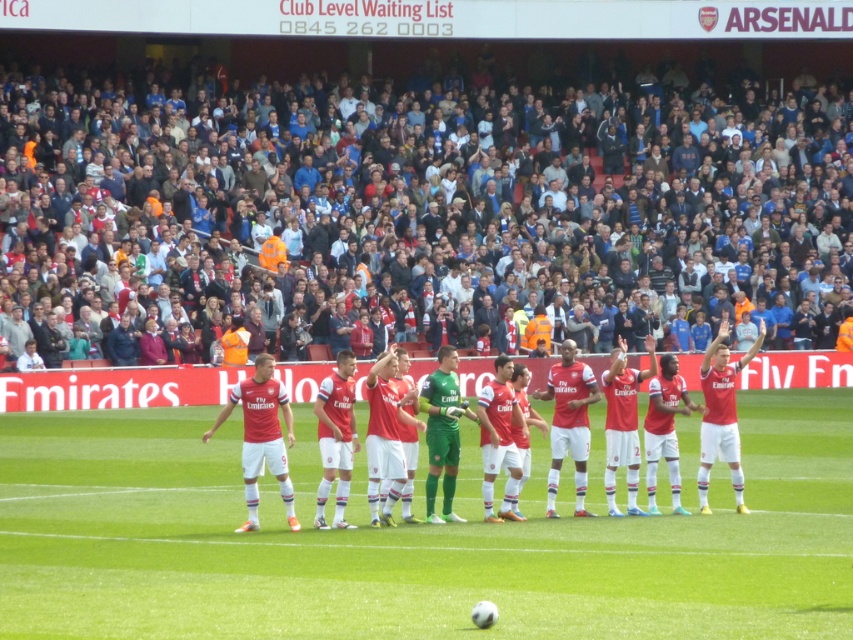
Does multicolored fabric crowd at upper center have a lesser width compared to matte red jersey at center?

In fact, multicolored fabric crowd at upper center might be wider than matte red jersey at center.

Locate an element on the screen. The height and width of the screenshot is (640, 853). multicolored fabric crowd at upper center is located at coordinates (x=421, y=228).

Is point (325, 269) farther from camera compared to point (583, 428)?

Yes, point (325, 269) is behind point (583, 428).

You are a GUI agent. You are given a task and a screenshot of the screen. Output one action in this format:
    pyautogui.click(x=<x>, y=<y>)
    Task: Click on the multicolored fabric crowd at upper center
    Image resolution: width=853 pixels, height=640 pixels.
    Given the screenshot: What is the action you would take?
    [421, 228]

Is multicolored fabric crowd at upper center wider than red matte jersey at center?

Yes.

Does point (7, 240) lie behind point (498, 362)?

That is True.

Image resolution: width=853 pixels, height=640 pixels. I want to click on multicolored fabric crowd at upper center, so click(421, 228).

Consider the image. Does green grass football field at center lie behind red matte jersey at center?

No, it is not.

Measure the distance between green grass football field at center and camera.

green grass football field at center is 13.43 meters away from camera.

Describe the element at coordinates (410, 540) in the screenshot. I see `green grass football field at center` at that location.

Locate an element on the screen. The image size is (853, 640). green grass football field at center is located at coordinates (410, 540).